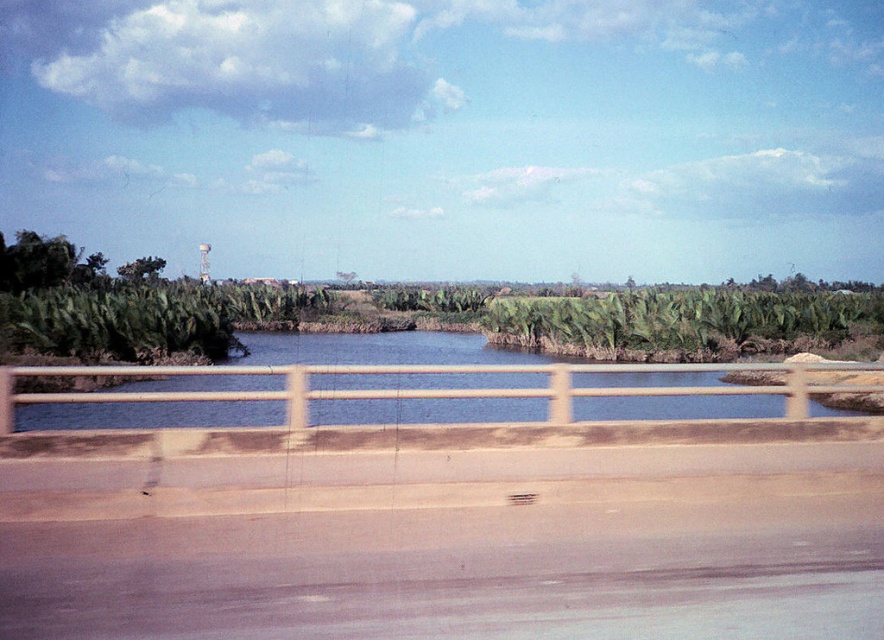
Question: Which of the following is the closest to the observer?

Choices:
 (A) green leafy tree at upper left
 (B) blue water at center

Answer: (B)

Question: From the image, what is the correct spatial relationship of blue water at center in relation to green leafy tree at upper left?

Choices:
 (A) left
 (B) right

Answer: (B)

Question: Considering the relative positions of blue water at center and green leafy tree at upper left in the image provided, where is blue water at center located with respect to green leafy tree at upper left?

Choices:
 (A) above
 (B) below

Answer: (B)

Question: Among these points, which one is nearest to the camera?

Choices:
 (A) click(127, 268)
 (B) click(389, 403)

Answer: (B)

Question: Is blue water at center wider than green leafy tree at upper left?

Choices:
 (A) yes
 (B) no

Answer: (A)